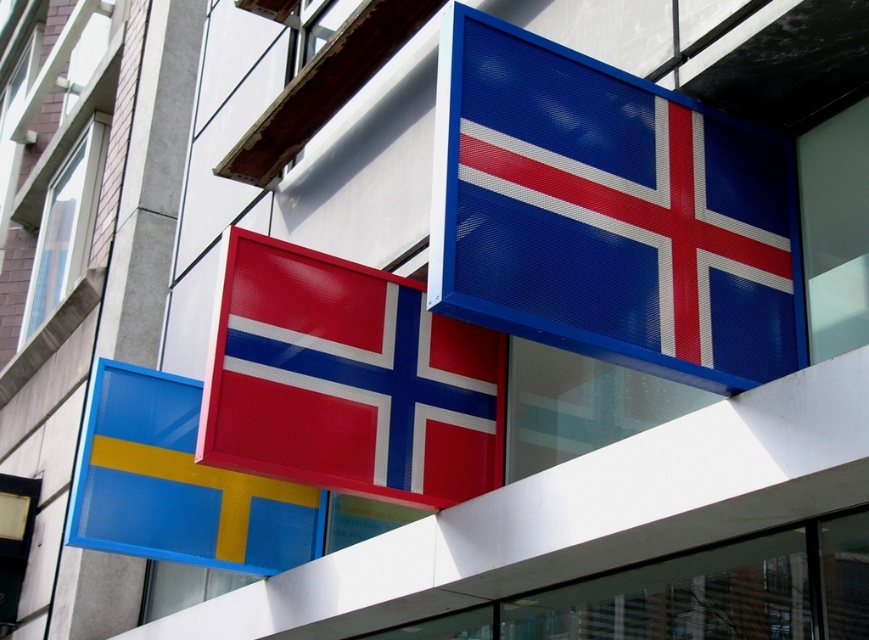
Describe the element at coordinates (608, 212) in the screenshot. I see `blue mesh flag at upper right` at that location.

Between blue mesh flag at upper right and matte plastic flag at lower left, which one has more height?

blue mesh flag at upper right

Does point (493, 140) come in front of point (222, 564)?

That is True.

At what (x,y) coordinates should I click in order to perform the action: click on blue mesh flag at upper right. Please return your answer as a coordinate pair (x, y). Looking at the image, I should click on (608, 212).

Does metallic red flag at center appear under matte plastic flag at lower left?

Incorrect, metallic red flag at center is not positioned below matte plastic flag at lower left.

Which is behind, point (231, 342) or point (170, 508)?

Point (170, 508)

Is point (406, 388) less distant than point (263, 520)?

Yes, it is in front of point (263, 520).

Locate an element on the screen. metallic red flag at center is located at coordinates (347, 380).

Is point (475, 54) farther from viewer compared to point (401, 461)?

No.

Measure the distance between blue mesh flag at upper right and camera.

The distance of blue mesh flag at upper right from camera is 5.62 meters.

Is point (446, 253) positioned in front of point (419, 401)?

Yes, it is.

This screenshot has height=640, width=869. What are the coordinates of `blue mesh flag at upper right` in the screenshot? It's located at point(608,212).